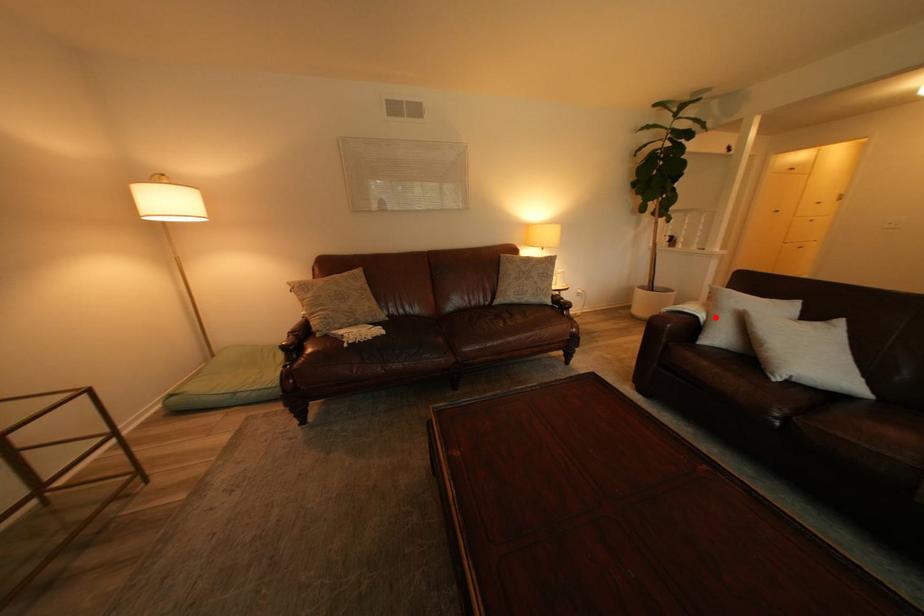
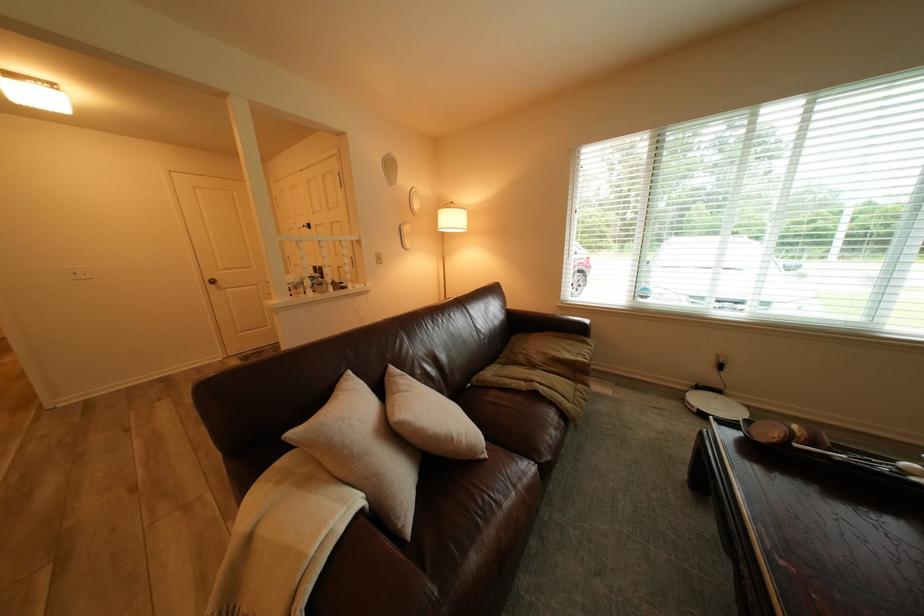
Where in the second image is the point corresponding to the highlighted location from the first image?

(372, 500)